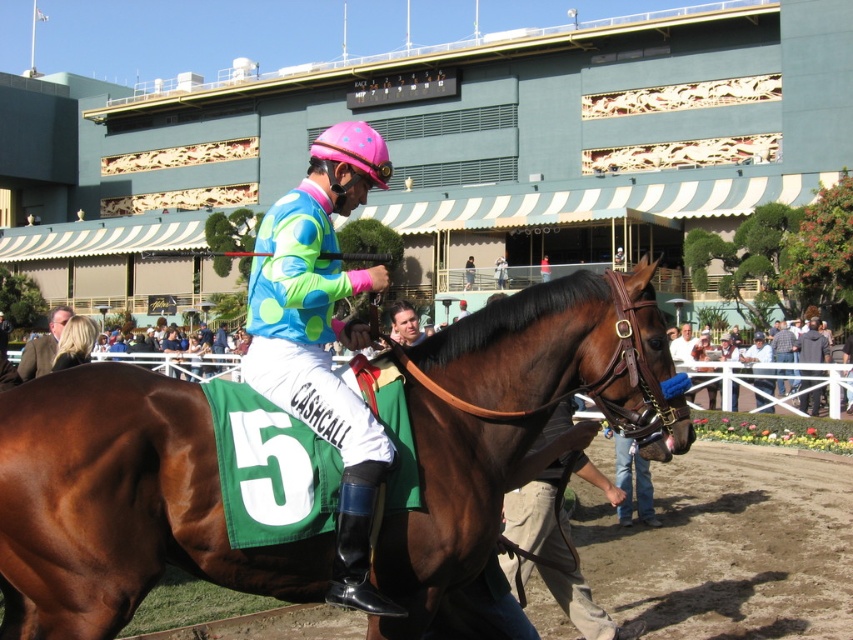
Can you confirm if brown glossy horse at center is wider than denim jacket at right?

No, brown glossy horse at center is not wider than denim jacket at right.

Can you confirm if brown glossy horse at center is thinner than denim jacket at right?

Correct, brown glossy horse at center's width is less than denim jacket at right's.

Locate an element on the screen. Image resolution: width=853 pixels, height=640 pixels. brown glossy horse at center is located at coordinates (120, 504).

Is neon polka dot jersey at center shorter than brown leather jacket at lower left?

Incorrect, neon polka dot jersey at center's height does not fall short of brown leather jacket at lower left's.

Can you confirm if neon polka dot jersey at center is smaller than brown leather jacket at lower left?

Yes.

Locate an element on the screen. neon polka dot jersey at center is located at coordinates (323, 339).

Does gray fabric jacket at right have a lesser width compared to denim jacket at right?

Correct, gray fabric jacket at right's width is less than denim jacket at right's.

Can you confirm if gray fabric jacket at right is taller than denim jacket at right?

No.

Is point (804, 346) less distant than point (776, 330)?

Yes, point (804, 346) is in front of point (776, 330).

You are a GUI agent. You are given a task and a screenshot of the screen. Output one action in this format:
    pyautogui.click(x=<x>, y=<y>)
    Task: Click on the gray fabric jacket at right
    This screenshot has width=853, height=640.
    Given the screenshot: What is the action you would take?
    pyautogui.click(x=811, y=342)